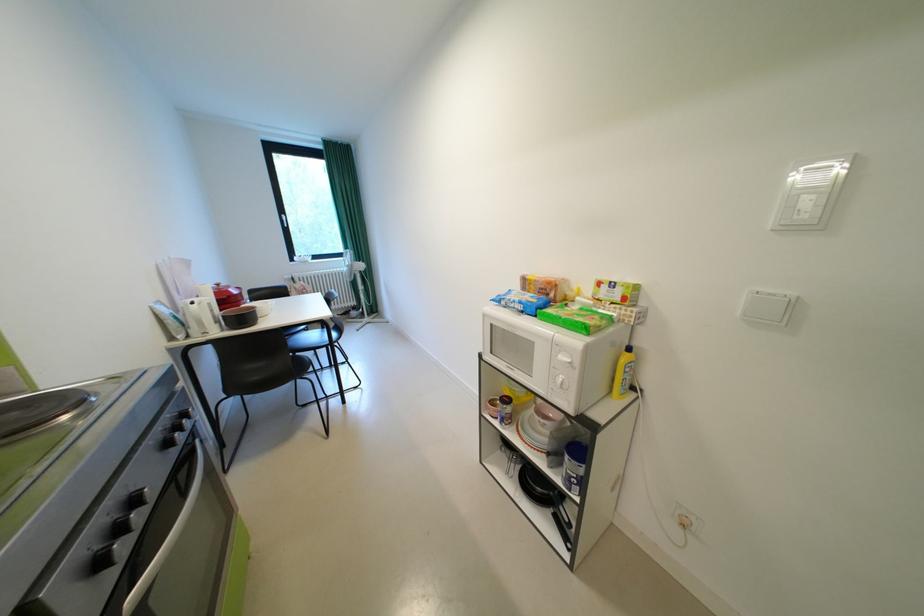
This screenshot has height=616, width=924. Find the location of `microwave door button`. microwave door button is located at coordinates (560, 399).